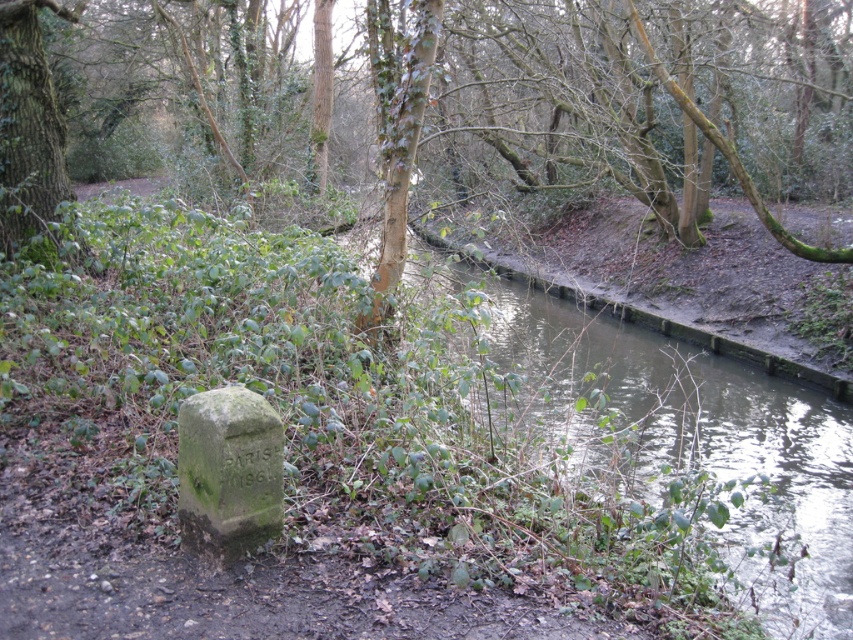
You are a hiker who has just arrived at the waterway and wants to cross it. There is a point marked at coordinates [701,429] on the mossy bank at center. Can you safely step on this point to cross the waterway?

The point marked at coordinates [701,429] on the mossy bank at center is part of the green mossy bank at center, which is a solid ground. Therefore, you can safely step on this point to cross the waterway.

You are a hiker who wants to cross the waterway shown in the image. You see the green mossy bank at center and the green mossy stone at lower left. Which of these two landmarks is higher in elevation?

The green mossy bank at center is located above the green mossy stone at lower left, so it has a higher elevation.

You are standing at the edge of the waterway and want to place a small wooden sign between the green mossy bank at center and the green rough bark tree at upper left. Which object should you place the sign closer to if you want it to be more visible to someone approaching from the front?

The green mossy bank at center is closer to the viewer than the green rough bark tree at upper left, so placing the sign closer to the green mossy bank at center would make it more visible to someone approaching from the front.